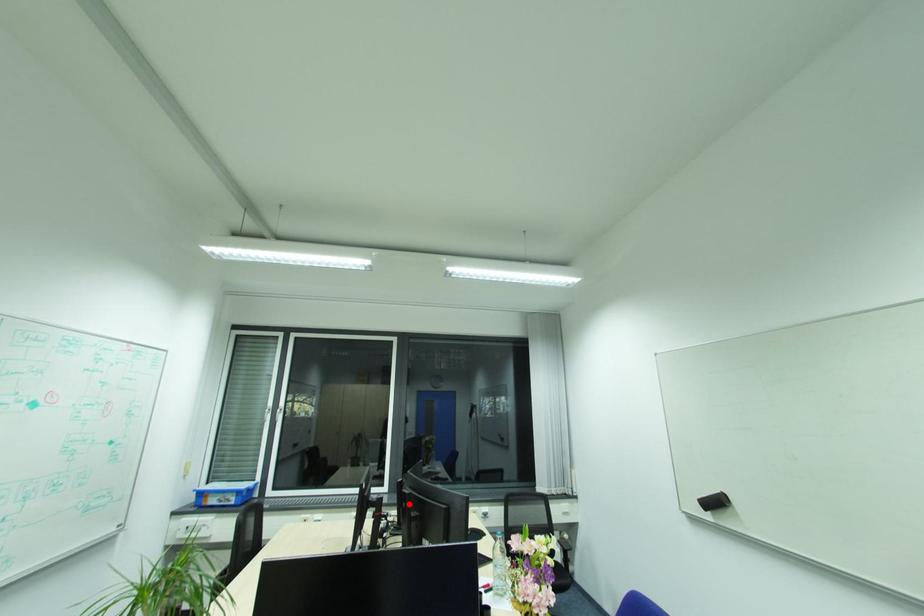
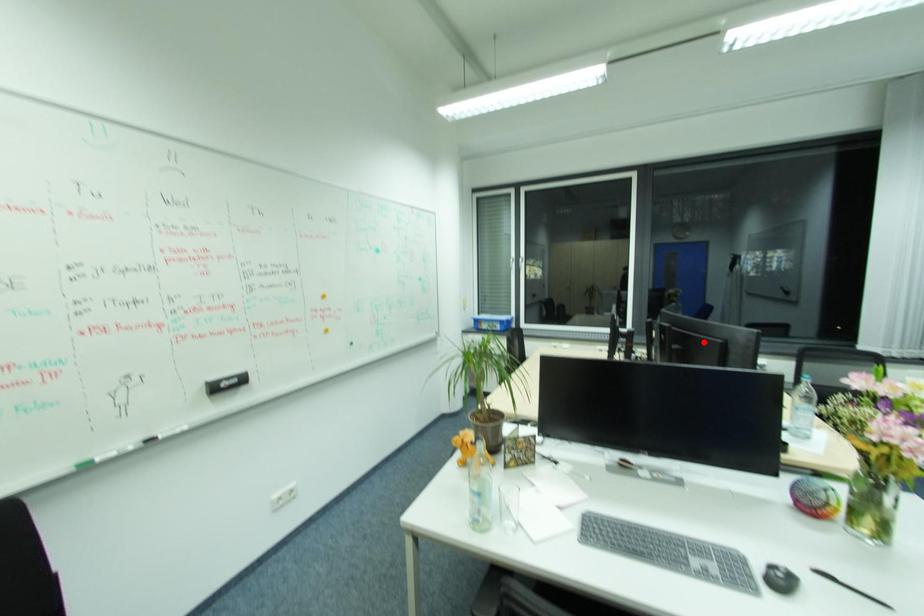
I am providing you with two images of the same scene from different viewpoints. A red point is marked on the first image and another point is marked on the second image. Does the point marked in image1 correspond to the same location as the one in image2?

No